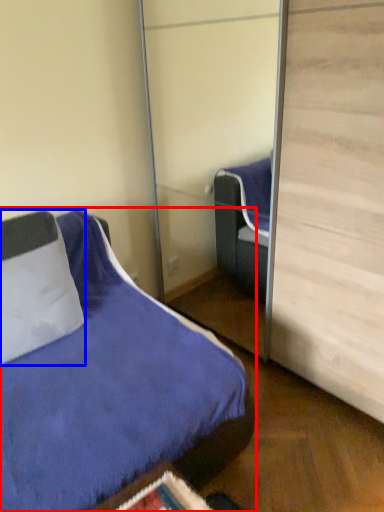
Question: Among these objects, which one is nearest to the camera, bed (highlighted by a red box) or pillow (highlighted by a blue box)?

Choices:
 (A) bed
 (B) pillow

Answer: (A)